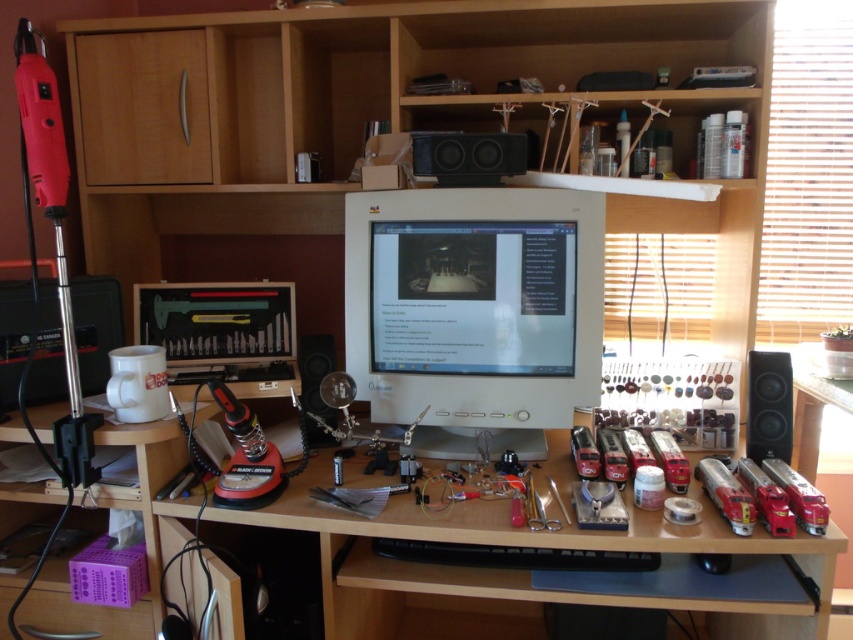
Question: Can you confirm if white plastic monitor at center is positioned to the right of matte black speaker at center?

Choices:
 (A) no
 (B) yes

Answer: (B)

Question: Is black matte speaker at upper center smaller than matte black speaker at center?

Choices:
 (A) no
 (B) yes

Answer: (A)

Question: Which point is farther to the camera?

Choices:
 (A) (786, 540)
 (B) (523, 227)
 (C) (508, 136)

Answer: (B)

Question: Estimate the real-world distances between objects in this image. Which object is farther from the black matte speaker at right?

Choices:
 (A) white glossy monitor at center
 (B) white plastic monitor at center
 (C) matte black speaker at center
 (D) black matte speaker at upper center

Answer: (C)

Question: Is white plastic monitor at center smaller than matte black speaker at center?

Choices:
 (A) no
 (B) yes

Answer: (A)

Question: Which object appears farthest from the camera in this image?

Choices:
 (A) black matte speaker at right
 (B) matte black speaker at center

Answer: (B)